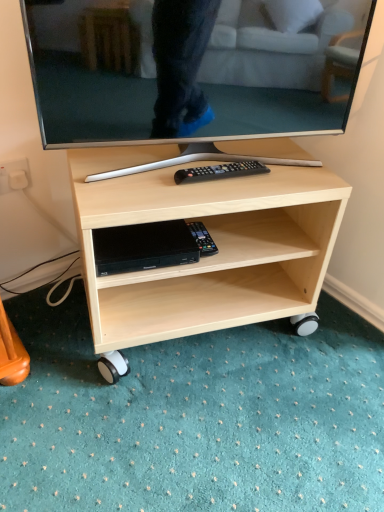
Locate an element on the screen. free space that is in between matte black tv at center and black plastic remote at center is located at coordinates (178, 180).